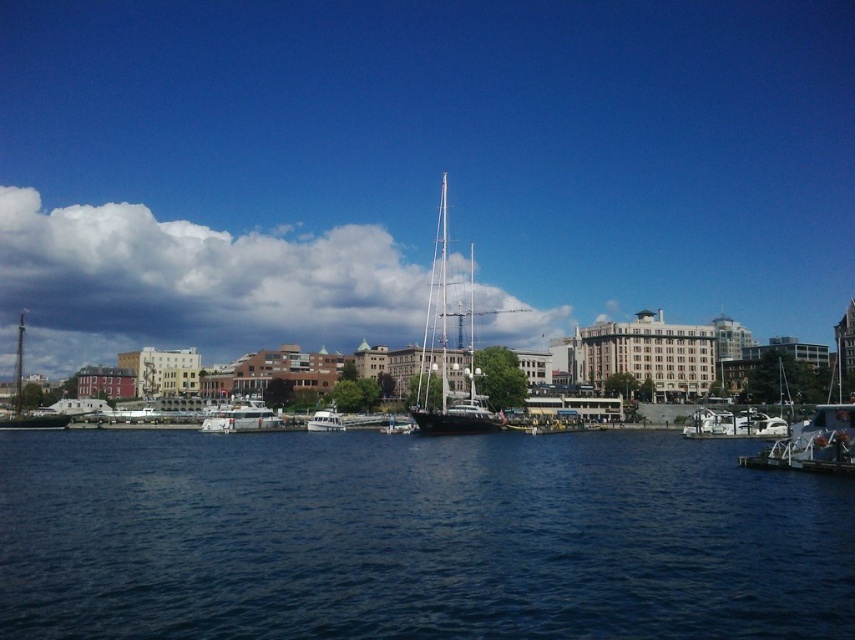
Which is more to the left, dark blue water at center or white matte boat at center?

white matte boat at center

Is point (9, 576) in front of point (317, 420)?

Yes, point (9, 576) is closer to viewer.

Locate an element on the screen. dark blue water at center is located at coordinates (414, 538).

Which is behind, point (443, 388) or point (334, 410)?

Point (334, 410)

Is shiny black sailboat at center closer to camera compared to white matte boat at center?

Yes, shiny black sailboat at center is closer to the viewer.

Image resolution: width=855 pixels, height=640 pixels. What do you see at coordinates (447, 353) in the screenshot?
I see `shiny black sailboat at center` at bounding box center [447, 353].

You are a GUI agent. You are given a task and a screenshot of the screen. Output one action in this format:
    pyautogui.click(x=<x>, y=<y>)
    Task: Click on the shiny black sailboat at center
    
    Given the screenshot: What is the action you would take?
    pyautogui.click(x=447, y=353)

Does white glossy boat at lower right have a lesser width compared to white glossy boat at left?

Incorrect, white glossy boat at lower right's width is not less than white glossy boat at left's.

Based on the photo, how far apart are white glossy boat at lower right and white glossy boat at left?

white glossy boat at lower right is 201.97 feet from white glossy boat at left.

Where is `white glossy boat at lower right`? white glossy boat at lower right is located at coordinates (733, 424).

The height and width of the screenshot is (640, 855). I want to click on white glossy boat at lower right, so click(x=733, y=424).